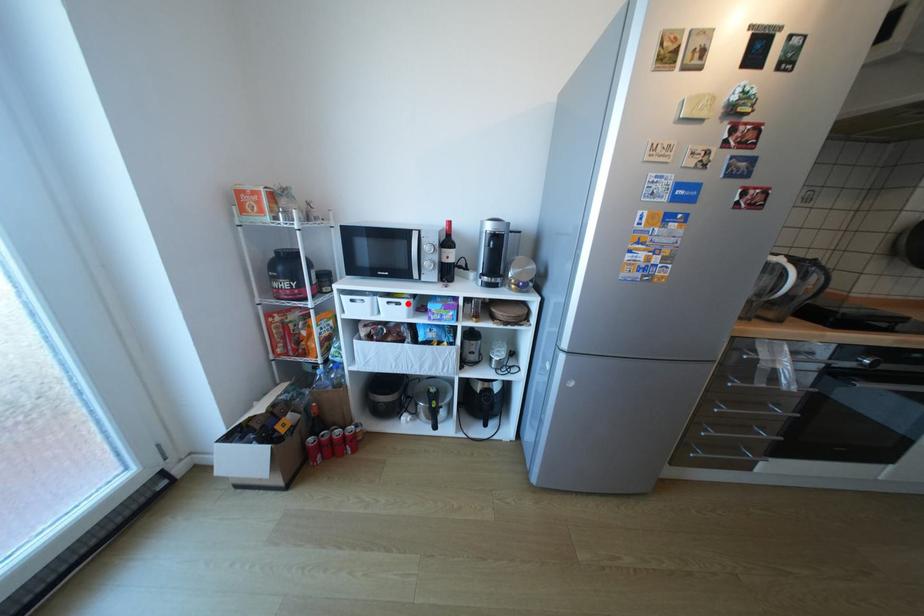
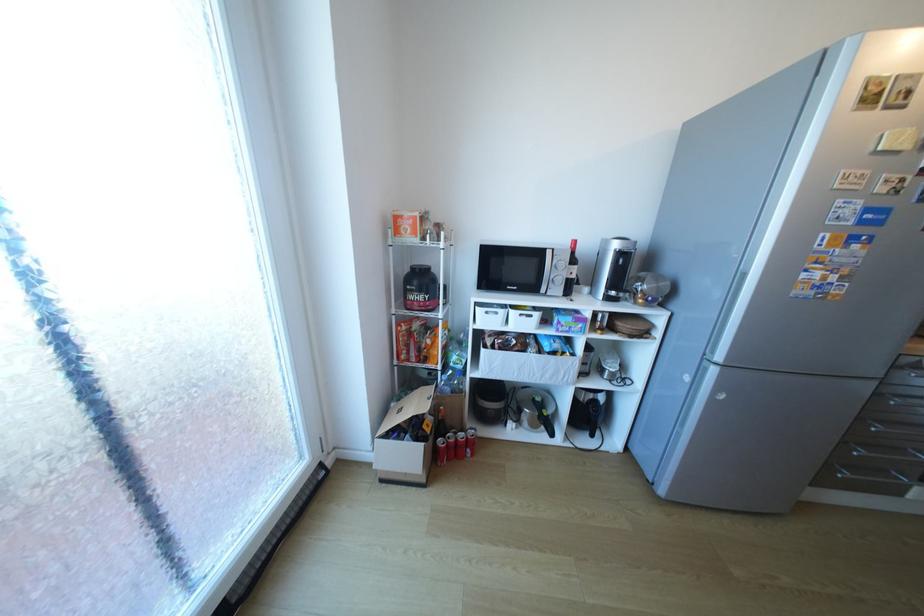
In the second image, find the point that corresponds to the highlighted location in the first image.

(540, 315)